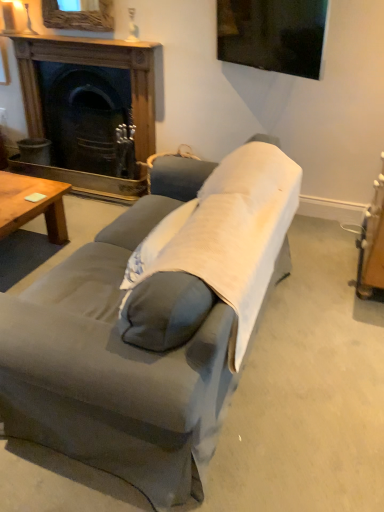
Measure the distance between point (176, 216) and camera.

Point (176, 216) is 1.85 meters from camera.

This screenshot has width=384, height=512. What do you see at coordinates (149, 331) in the screenshot? I see `gray fabric couch at center` at bounding box center [149, 331].

In order to face wooden coffee table at lower left, should I rotate leftwards or rightwards?

Turn left approximately 24.673 degrees to face it.

The width and height of the screenshot is (384, 512). I want to click on light gray fabric pillow at center, so click(x=156, y=243).

Considering the relative positions of wooden coffee table at lower left and light gray fabric pillow at center in the image provided, is wooden coffee table at lower left behind light gray fabric pillow at center?

Yes, wooden coffee table at lower left is further from the viewer.

Considering the relative sizes of wooden coffee table at lower left and light gray fabric pillow at center in the image provided, is wooden coffee table at lower left wider than light gray fabric pillow at center?

Yes.

Is wooden coffee table at lower left to the right of light gray fabric pillow at center from the viewer's perspective?

No.

Is point (41, 202) behind point (170, 226)?

Yes, it is.

Considering the relative sizes of gray fabric couch at center and light gray fabric pillow at center in the image provided, is gray fabric couch at center wider than light gray fabric pillow at center?

Correct, the width of gray fabric couch at center exceeds that of light gray fabric pillow at center.

Do you think gray fabric couch at center is within light gray fabric pillow at center, or outside of it?

The correct answer is: outside.

From the picture: How many degrees apart are the facing directions of gray fabric couch at center and light gray fabric pillow at center?

The facing directions of gray fabric couch at center and light gray fabric pillow at center are 86.5 degrees apart.

Are wooden fireplace at upper left and light gray fabric pillow at center located far from each other?

Yes, wooden fireplace at upper left and light gray fabric pillow at center are quite far apart.

In order to click on fireplace located behind the light gray fabric pillow at center in this screenshot , I will do `click(94, 65)`.

Which of these two, wooden fireplace at upper left or light gray fabric pillow at center, is thinner?

Thinner between the two is light gray fabric pillow at center.

Is light gray fabric pillow at center further to camera compared to wooden fireplace at upper left?

No, it is in front of wooden fireplace at upper left.

From the image's perspective, between light gray fabric pillow at center and wooden fireplace at upper left, who is located below?

light gray fabric pillow at center is shown below in the image.

I want to click on pillow located on the right of wooden fireplace at upper left, so click(156, 243).

Considering the points (4, 179) and (220, 301), which point is behind, point (4, 179) or point (220, 301)?

Positioned behind is point (4, 179).

From the image's perspective, which object appears higher, wooden coffee table at lower left or gray fabric couch at center?

wooden coffee table at lower left is shown above in the image.

Who is bigger, wooden coffee table at lower left or gray fabric couch at center?

With larger size is gray fabric couch at center.

Is wooden coffee table at lower left oriented away from gray fabric couch at center?

No, wooden coffee table at lower left is not facing away from gray fabric couch at center.

Between gray fabric couch at center and wooden fireplace at upper left, which one appears on the left side from the viewer's perspective?

Positioned to the left is wooden fireplace at upper left.

From the image's perspective, between gray fabric couch at center and wooden fireplace at upper left, who is located below?

gray fabric couch at center.

Is point (247, 315) positioned before point (121, 45)?

That is True.

Is gray fabric couch at center looking in the opposite direction of wooden fireplace at upper left?

gray fabric couch at center is not turned away from wooden fireplace at upper left.

Visually, is wooden fireplace at upper left positioned to the left or to the right of wooden coffee table at lower left?

wooden fireplace at upper left is positioned on wooden coffee table at lower left's right side.

From a real-world perspective, who is located lower, wooden fireplace at upper left or wooden coffee table at lower left?

wooden coffee table at lower left is physically lower.

From the image's perspective, does wooden fireplace at upper left appear lower than wooden coffee table at lower left?

No.

Which is farther from the camera, (17, 55) or (17, 212)?

The point (17, 55) is farther.

You are a GUI agent. You are given a task and a screenshot of the screen. Output one action in this format:
    pyautogui.click(x=<x>, y=<y>)
    Task: Click on the pillow in front of the wooden coffee table at lower left
    This screenshot has height=512, width=384.
    Given the screenshot: What is the action you would take?
    pyautogui.click(x=156, y=243)

Locate an element on the screen. pillow lying on the right of gray fabric couch at center is located at coordinates click(156, 243).

When comparing their distances from wooden fireplace at upper left, does light gray fabric pillow at center or wooden coffee table at lower left seem further?

Based on the image, light gray fabric pillow at center appears to be further to wooden fireplace at upper left.

Which object lies further to the anchor point wooden coffee table at lower left, light gray fabric pillow at center or wooden fireplace at upper left?

light gray fabric pillow at center is further to wooden coffee table at lower left.

Estimate the real-world distances between objects in this image. Which object is further from wooden fireplace at upper left, gray fabric couch at center or light gray fabric pillow at center?

light gray fabric pillow at center lies further to wooden fireplace at upper left than the other object.

Estimate the real-world distances between objects in this image. Which object is further from wooden coffee table at lower left, wooden fireplace at upper left or light gray fabric pillow at center?

The object further to wooden coffee table at lower left is light gray fabric pillow at center.

Looking at the image, which one is located further to wooden coffee table at lower left, light gray fabric pillow at center or gray fabric couch at center?

Among the two, gray fabric couch at center is located further to wooden coffee table at lower left.

From the picture: Estimate the real-world distances between objects in this image. Which object is further from wooden fireplace at upper left, wooden coffee table at lower left or gray fabric couch at center?

gray fabric couch at center lies further to wooden fireplace at upper left than the other object.

Considering their positions, is wooden coffee table at lower left positioned further to gray fabric couch at center than wooden fireplace at upper left?

Based on the image, wooden fireplace at upper left appears to be further to gray fabric couch at center.

Which object lies nearer to the anchor point gray fabric couch at center, wooden coffee table at lower left or light gray fabric pillow at center?

Among the two, light gray fabric pillow at center is located nearer to gray fabric couch at center.

Find the location of a particular element. coffee table between light gray fabric pillow at center and wooden fireplace at upper left from front to back is located at coordinates pos(32,205).

Identify the location of pillow between gray fabric couch at center and wooden fireplace at upper left from front to back. This screenshot has width=384, height=512. (156, 243).

The height and width of the screenshot is (512, 384). I want to click on studio couch between wooden coffee table at lower left and light gray fabric pillow at center, so click(149, 331).

What are the coordinates of `coffee table between gray fabric couch at center and wooden fireplace at upper left in the front-back direction` in the screenshot? It's located at (x=32, y=205).